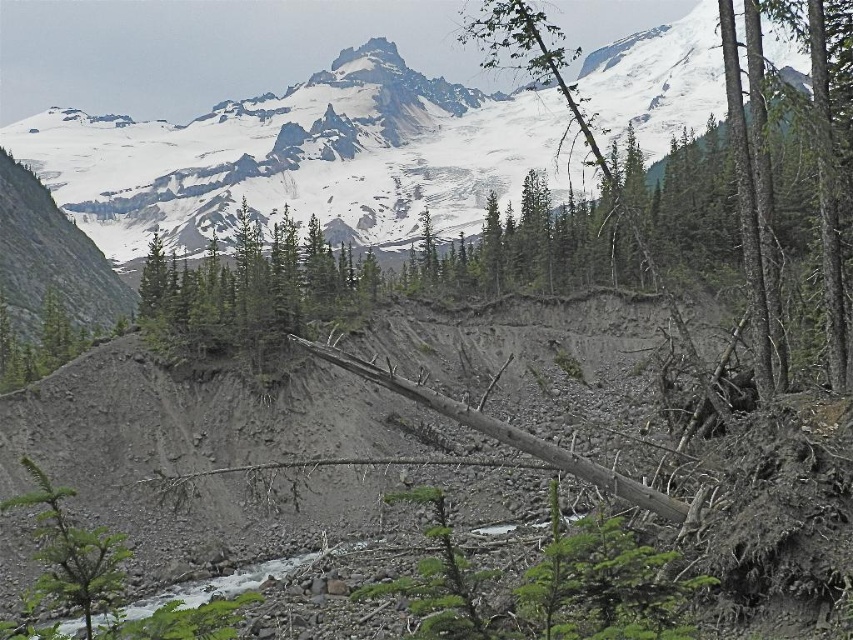
Question: From the image, what is the correct spatial relationship of snowy granite mountain at upper center in relation to green matte tree at center?

Choices:
 (A) right
 (B) left

Answer: (A)

Question: Can you confirm if green matte tree at center is positioned above green leafy tree at upper center?

Choices:
 (A) yes
 (B) no

Answer: (B)

Question: Is snowy granite mountain at upper center above green leafy tree at upper center?

Choices:
 (A) no
 (B) yes

Answer: (B)

Question: Which object appears farthest from the camera in this image?

Choices:
 (A) snowy granite mountain at upper center
 (B) green leafy tree at upper center
 (C) green matte tree at center

Answer: (C)

Question: Which of the following is the closest to the observer?

Choices:
 (A) (616, 189)
 (B) (177, 305)

Answer: (A)

Question: Which point appears closest to the camera in this image?

Choices:
 (A) (233, 264)
 (B) (514, 104)

Answer: (A)